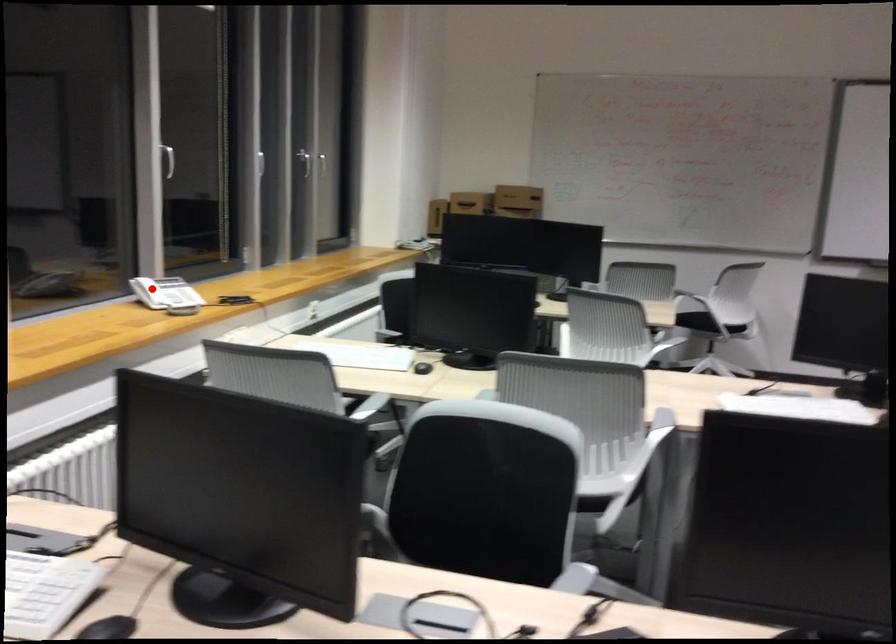
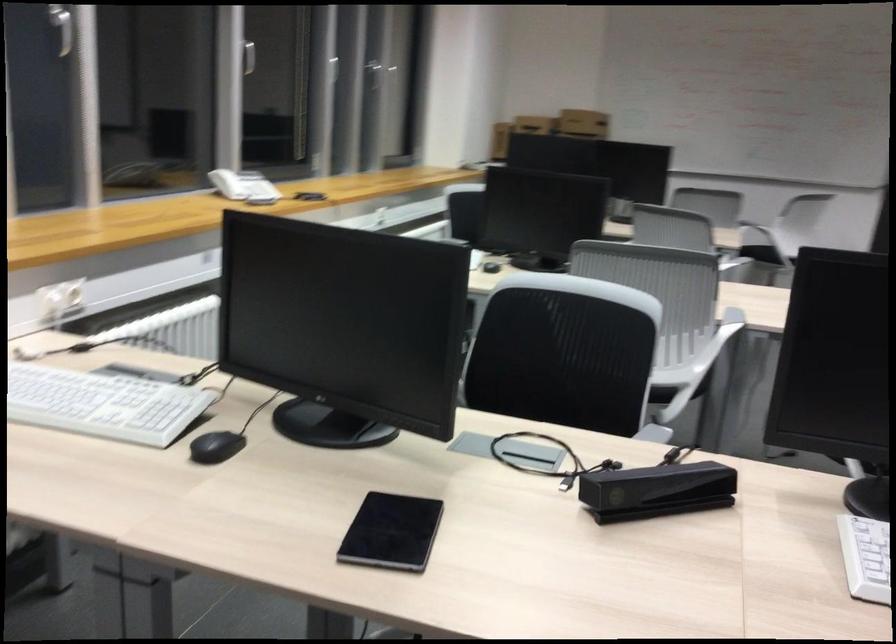
Where in the second image is the point corresponding to the highlighted location from the first image?

(227, 184)